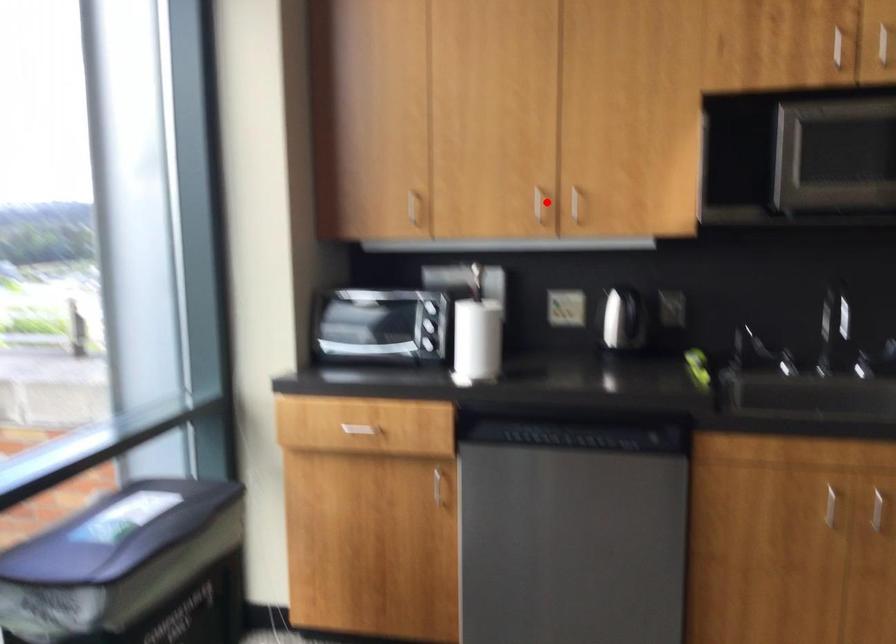
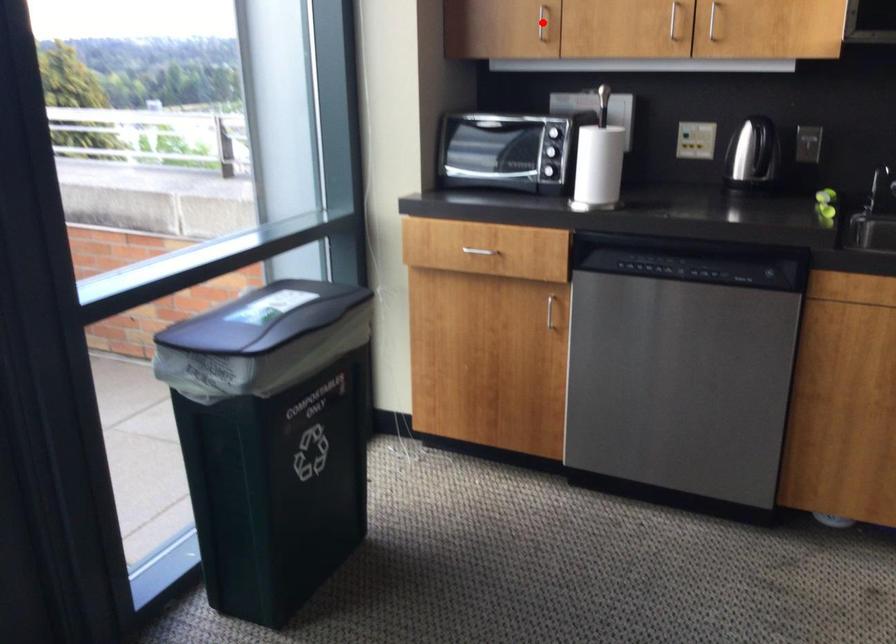
I am providing you with two images of the same scene from different viewpoints. A red point is marked on the first image and another point is marked on the second image. Are the points marked in image1 and image2 representing the same 3D position?

No